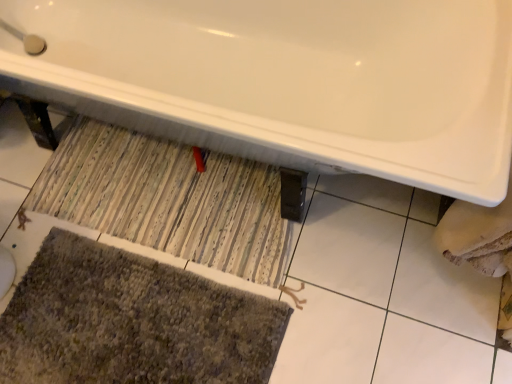
The image size is (512, 384). I want to click on empty space that is ontop of textured gray bath mat at lower left (from a real-world perspective), so click(x=129, y=329).